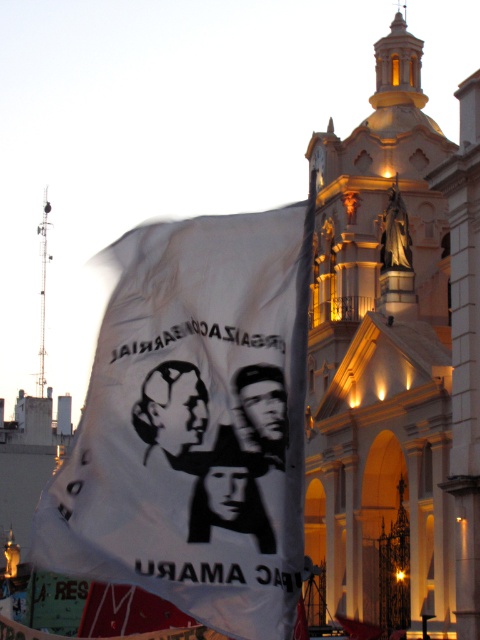
Question: Considering the real-world distances, which object is farthest from the black matte portrait at center?

Choices:
 (A) white paper flag at center
 (B) black glossy face at center

Answer: (B)

Question: Does black matte face at center appear over black matte portrait at center?

Choices:
 (A) no
 (B) yes

Answer: (A)

Question: Is black matte face at center thinner than black matte portrait at center?

Choices:
 (A) no
 (B) yes

Answer: (A)

Question: Is white paper flag at center positioned before black matte portrait at center?

Choices:
 (A) yes
 (B) no

Answer: (A)

Question: Estimate the real-world distances between objects in this image. Which object is farther from the black matte face at center?

Choices:
 (A) black glossy face at center
 (B) black matte portrait at center

Answer: (B)

Question: Which of the following is the closest to the observer?

Choices:
 (A) white paper flag at center
 (B) black glossy face at center
 (C) black matte face at center
 (D) black matte portrait at center

Answer: (A)